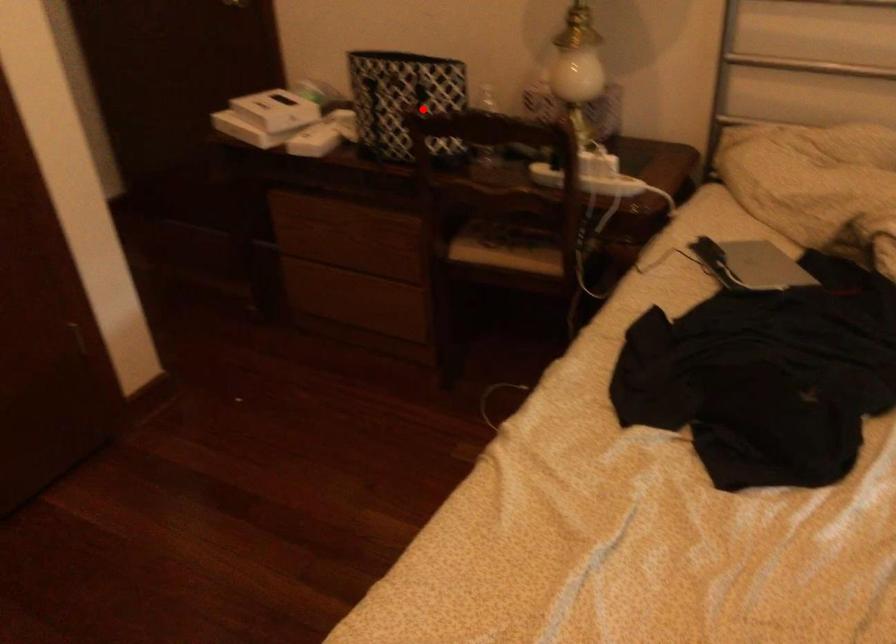
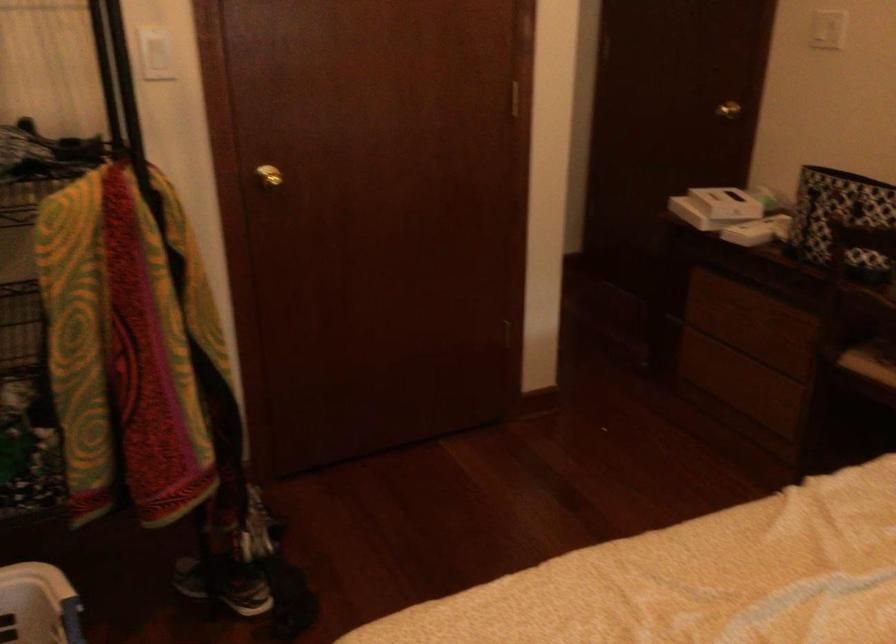
The point at the highlighted location is marked in the first image. Where is the corresponding point in the second image?

(840, 218)